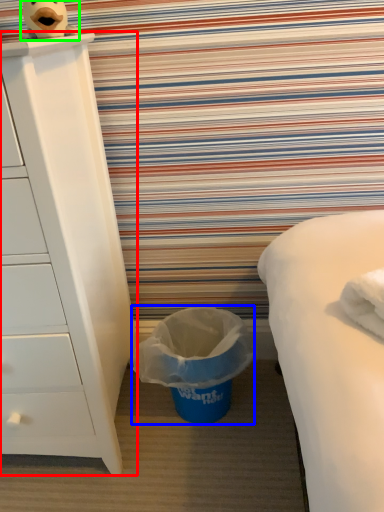
Question: Based on their relative distances, which object is nearer to chest of drawers (highlighted by a red box)? Choose from garbage (highlighted by a blue box) and toy (highlighted by a green box).

Choices:
 (A) garbage
 (B) toy

Answer: (A)